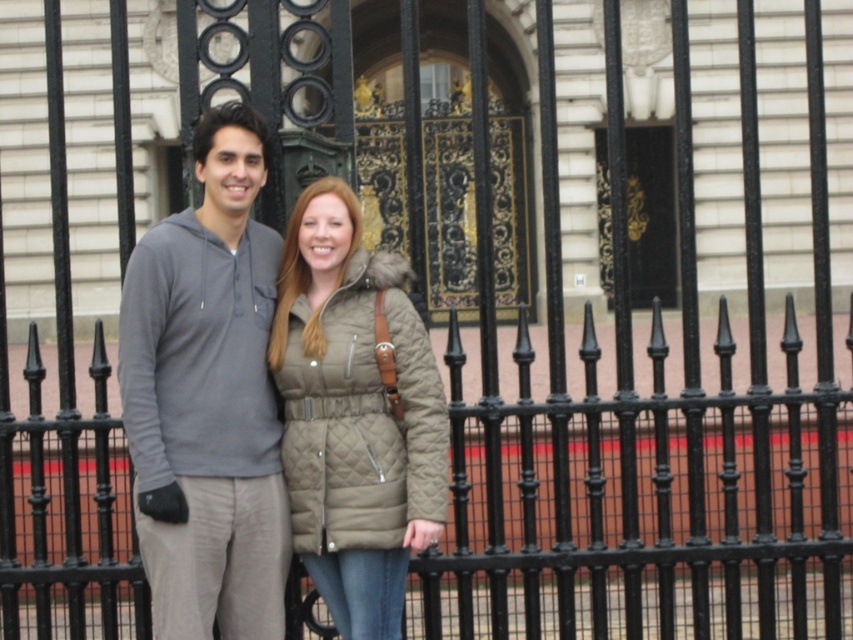
You are a photographer trying to capture the gold ornate door at center without the quilted olive coat at center blocking the view. What should you do?

Move the quilted olive coat at center away from the gold ornate door at center so it is no longer blocking the view.

You are a photographer trying to capture both the gray hoodie at center and the gold ornate door at center in a single frame. Based on their positions, which object should you focus on first to ensure both are in the shot?

The gray hoodie at center is located below the gold ornate door at center, so you should focus on the gold ornate door at center first to ensure both are in the shot.

You are a photographer trying to capture both the gray hoodie at center and the quilted olive coat at center in a single frame. Which of the two clothing items requires more space in the frame to accommodate its width?

The quilted olive coat at center requires more space in the frame because its width is greater than the gray hoodie at center.